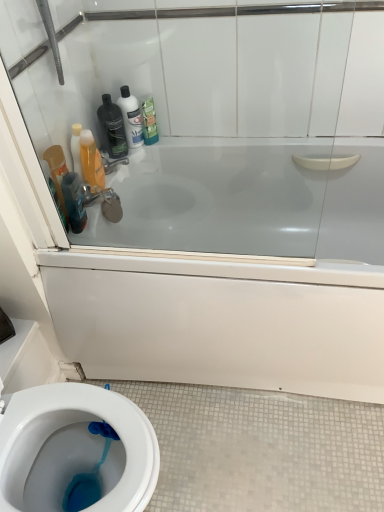
The image size is (384, 512). In order to click on free location in front of translucent plastic mouthwash at left, acting as the first mouthwash starting from the left in this screenshot , I will do `click(78, 248)`.